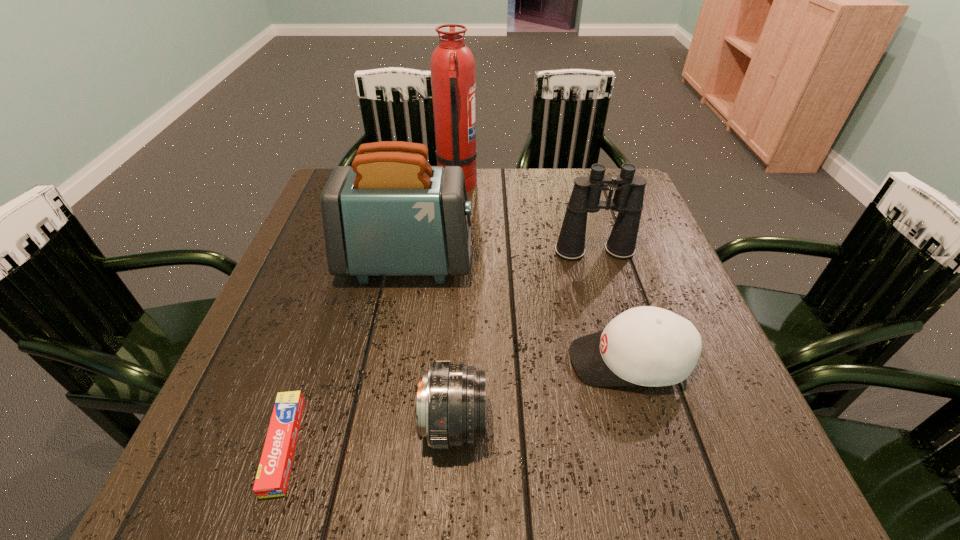
Identify the location of binoculars positioned at the right edge. (628, 198).

This screenshot has height=540, width=960. In order to click on baseball cap at the right edge in this screenshot , I will do `click(644, 346)`.

Where is `object present at the near left corner`? The width and height of the screenshot is (960, 540). object present at the near left corner is located at coordinates (273, 473).

Where is `vacant region at the far edge`? This screenshot has width=960, height=540. vacant region at the far edge is located at coordinates [x=519, y=172].

The image size is (960, 540). In the image, there is a desktop. Identify the location of vacant space at the near edge. (405, 477).

In the image, there is a desktop. Where is `free space at the left edge`? free space at the left edge is located at coordinates (282, 354).

The image size is (960, 540). I want to click on free space at the right edge, so click(x=674, y=442).

In order to click on free space between the baseball cap and the farthest object in this screenshot , I will do `click(543, 273)`.

Locate an element on the screen. Image resolution: width=960 pixels, height=540 pixels. free space between the telephoto lens and the binoculars is located at coordinates point(524,338).

At what (x,y) coordinates should I click in order to perform the action: click on vacant area that lies between the fire extinguisher and the toothpaste. Please return your answer as a coordinate pair (x, y). Looking at the image, I should click on (371, 315).